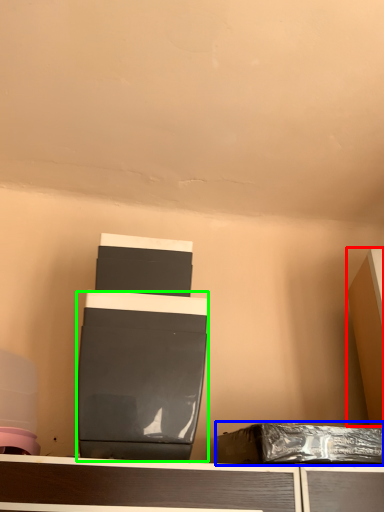
Question: Which object is the farthest from furniture (highlighted by a red box)? Choose among these: waste (highlighted by a blue box) or wide (highlighted by a green box).

Choices:
 (A) waste
 (B) wide

Answer: (B)